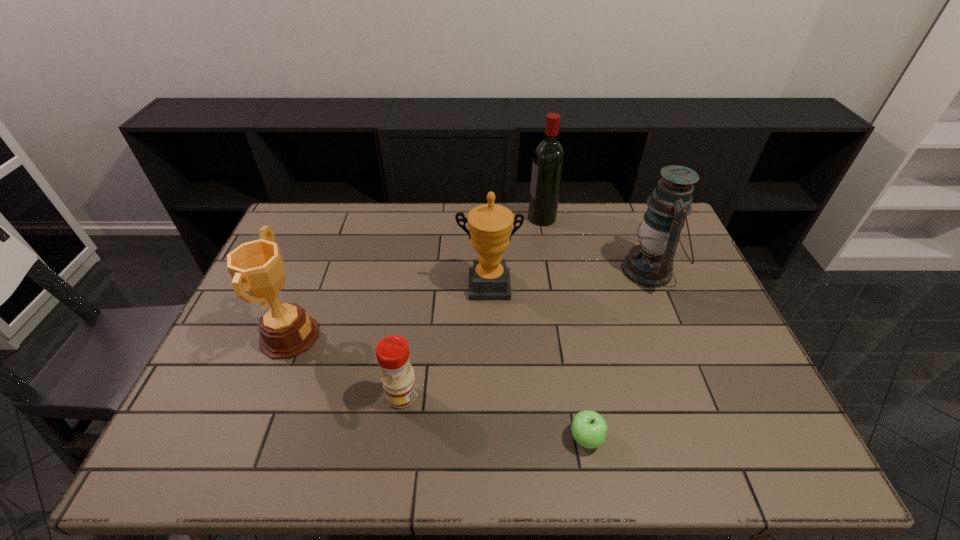
What are the coordinates of `free region located 0.360m on the label of the wine bottle` in the screenshot? It's located at (428, 218).

This screenshot has height=540, width=960. In order to click on vacant space situated 0.280m on the label of the wine bottle in this screenshot , I will do `click(450, 218)`.

Locate an element on the screen. This screenshot has height=540, width=960. vacant region located 0.350m on the label of the wine bottle is located at coordinates (431, 218).

Where is `vacant region located 0.170m on the back of the rightmost object`? This screenshot has width=960, height=540. vacant region located 0.170m on the back of the rightmost object is located at coordinates (628, 217).

At what (x,y) coordinates should I click in order to perform the action: click on free space located at the front of the right award with handles. Please return your answer as a coordinate pair (x, y). The height and width of the screenshot is (540, 960). Looking at the image, I should click on (490, 366).

Where is `vacant space located on the front-facing side of the nearer award`? vacant space located on the front-facing side of the nearer award is located at coordinates (373, 336).

Identify the location of free space located on the left of the condiment. (280, 395).

The image size is (960, 540). Identify the location of blank space located on the left of the apple. (538, 438).

The height and width of the screenshot is (540, 960). Identify the location of object at the far edge. (548, 161).

Locate an element on the screen. object present at the near edge is located at coordinates (589, 429).